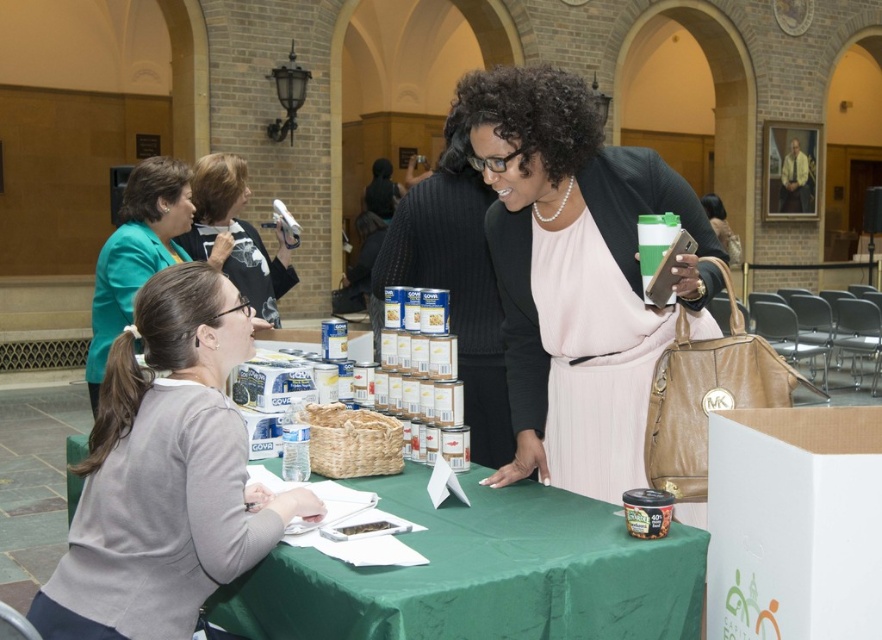
You are organizing a clothing donation drive and need to determine which item takes up more space. Based on the scene, which item between the matte black jacket at center and the gray sweater at lower left should be placed in a larger storage container?

The matte black jacket at center is larger in size than the gray sweater at lower left, so it should be placed in a larger storage container.

What are the coordinates of the gray sweater at lower left in the image?

The gray sweater at lower left is located at coordinates point [165,474].